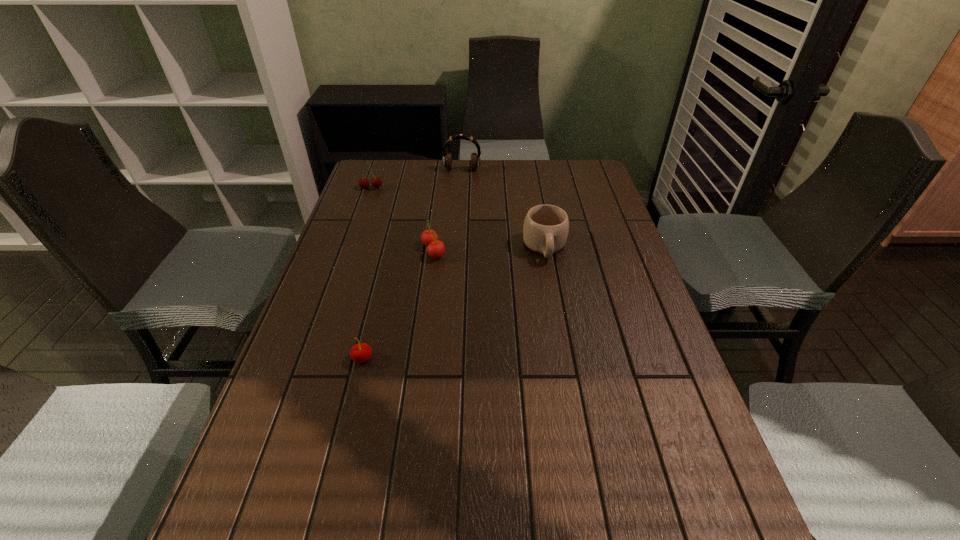
Locate an element on the screen. free spot located on the side of the rightmost object with the handle is located at coordinates (566, 370).

Locate an element on the screen. This screenshot has width=960, height=540. vacant region located on the left of the rightmost cherry is located at coordinates (347, 251).

I want to click on vacant area located on the right of the second object from left to right, so click(x=417, y=359).

You are a GUI agent. You are given a task and a screenshot of the screen. Output one action in this format:
    pyautogui.click(x=<x>, y=<y>)
    Task: Click on the headset present at the far edge
    The height and width of the screenshot is (540, 960).
    Given the screenshot: What is the action you would take?
    pyautogui.click(x=447, y=157)

This screenshot has width=960, height=540. I want to click on cherry that is at the far edge, so click(x=376, y=182).

The image size is (960, 540). What are the coordinates of `object located in the far left corner section of the desktop` in the screenshot? It's located at (376, 182).

Find the location of a particular element. The image size is (960, 540). free space at the far edge of the desktop is located at coordinates point(446,192).

What are the coordinates of `vacant space at the left edge of the desktop` in the screenshot? It's located at point(349,305).

Image resolution: width=960 pixels, height=540 pixels. Identify the location of free space at the right edge. (653, 397).

The image size is (960, 540). I want to click on vacant space at the far left corner of the desktop, so click(365, 170).